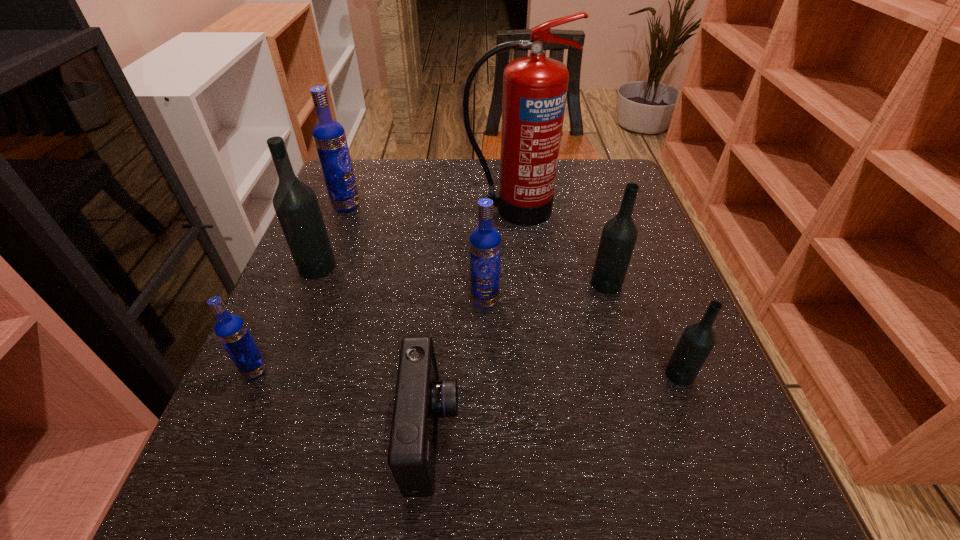
Image resolution: width=960 pixels, height=540 pixels. What are the coordinates of `the rightmost black vodka` in the screenshot? It's located at (697, 340).

Find the location of a particular element. Image resolution: width=960 pixels, height=540 pixels. the nearest black vodka is located at coordinates (697, 340).

Find the location of `blue camera`. blue camera is located at coordinates (421, 398).

Image resolution: width=960 pixels, height=540 pixels. What are the coordinates of `camera` in the screenshot? It's located at (421, 398).

This screenshot has width=960, height=540. In order to click on vacant area located 0.300m on the surface of the tallest object in this screenshot , I will do `click(522, 320)`.

Find the location of `free space located on the front of the farthest vodka`. free space located on the front of the farthest vodka is located at coordinates (296, 341).

Identify the location of free space located on the back of the leftmost black vodka. This screenshot has height=540, width=960. (345, 197).

Identify the location of vacant space located on the right of the rightmost blue vodka. This screenshot has height=540, width=960. (657, 301).

Locate an element on the screen. The image size is (960, 540). vacant space located 0.230m on the left of the second black vodka from left to right is located at coordinates (482, 284).

The height and width of the screenshot is (540, 960). In order to click on free location located on the back of the nearest blue vodka in this screenshot , I will do `click(283, 307)`.